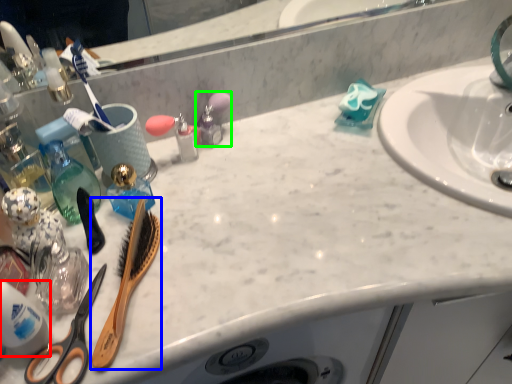
Question: Which object is positioned farthest from cleaning product (highlighted by a red box)? Select from brush (highlighted by a blue box) and toiletry (highlighted by a green box).

Choices:
 (A) brush
 (B) toiletry

Answer: (B)